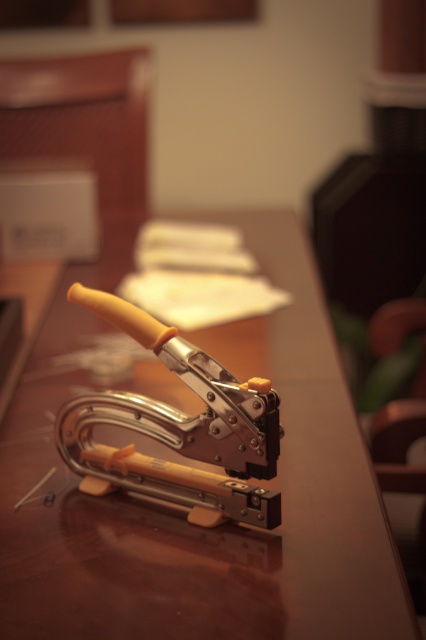
You are organizing your desk and want to place a new pen holder between the brown wooden table at center and the metallic silver stapler at center. Based on their positions, where should you place the pen holder?

The brown wooden table at center is above the metallic silver stapler at center, so you should place the pen holder between them either below the brown wooden table at center or above the metallic silver stapler at center to ensure it fits in the space between them.

You are organizing your desk and need to place a new item between the brown wooden table at center and the metallic silver stapler at center. Since both are at the center, where should you place the new item?

The brown wooden table at center is in front of the metallic silver stapler at center, so you should place the new item behind the brown wooden table at center but in front of the metallic silver stapler at center to maintain their spatial relationship.